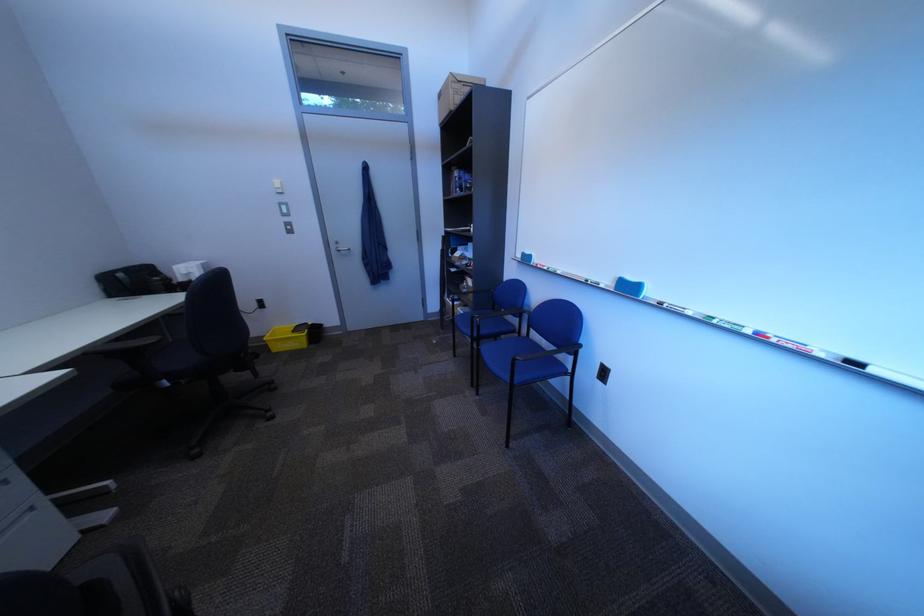
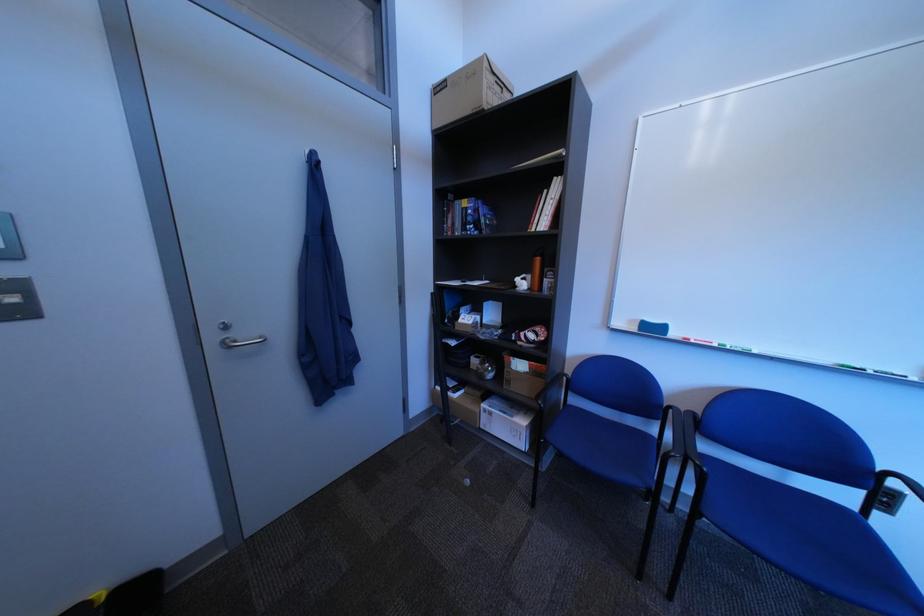
In the second image, find the point that corresponds to the point at 348,248 in the first image.

(226, 339)